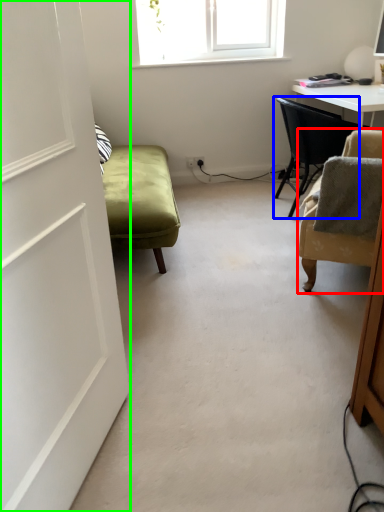
Question: Based on their relative distances, which object is nearer to chair (highlighted by a red box)? Choose from chair (highlighted by a blue box) and door (highlighted by a green box).

Choices:
 (A) chair
 (B) door

Answer: (A)